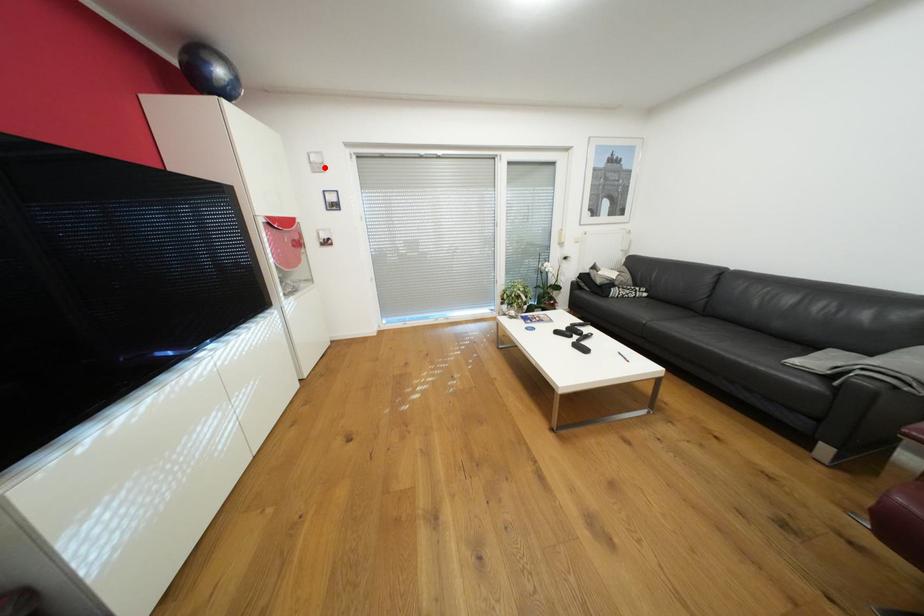
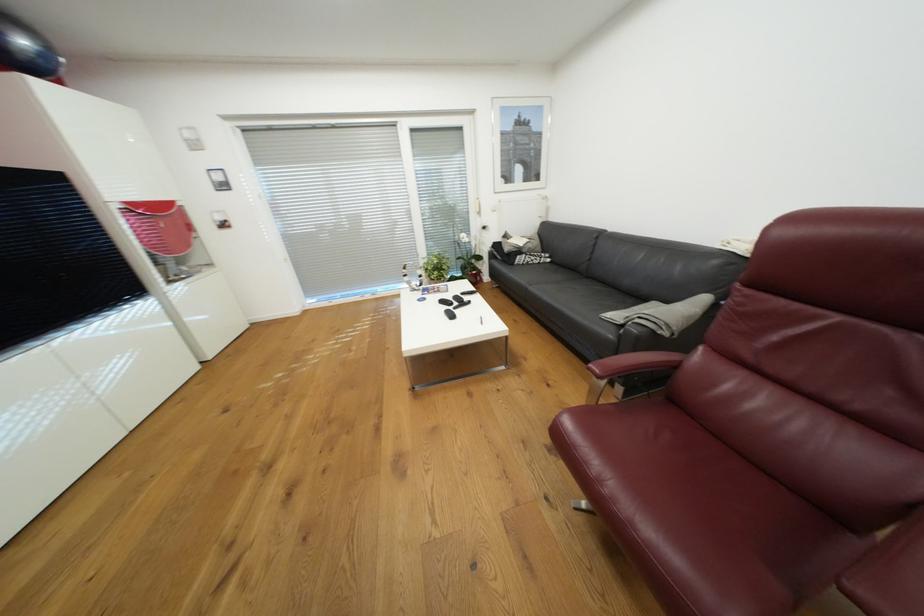
In the second image, find the point that corresponds to the highlighted location in the first image.

(201, 145)